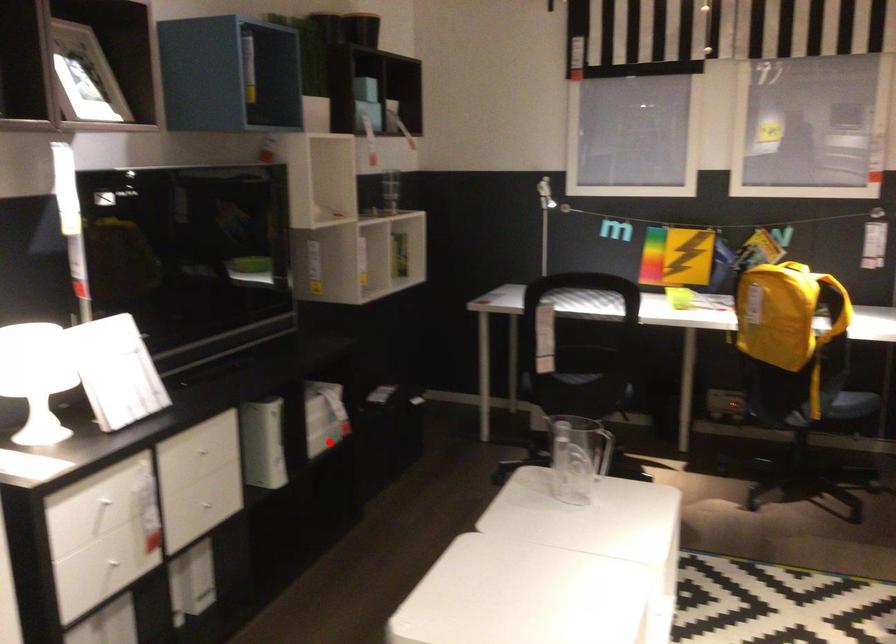
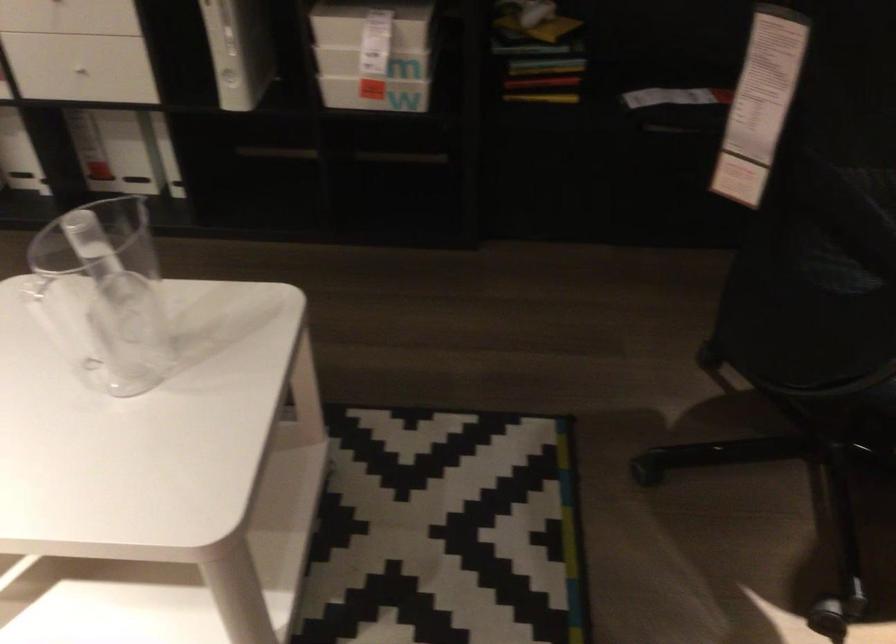
Where in the second image is the point corresponding to the highlighted location from the first image?

(375, 93)